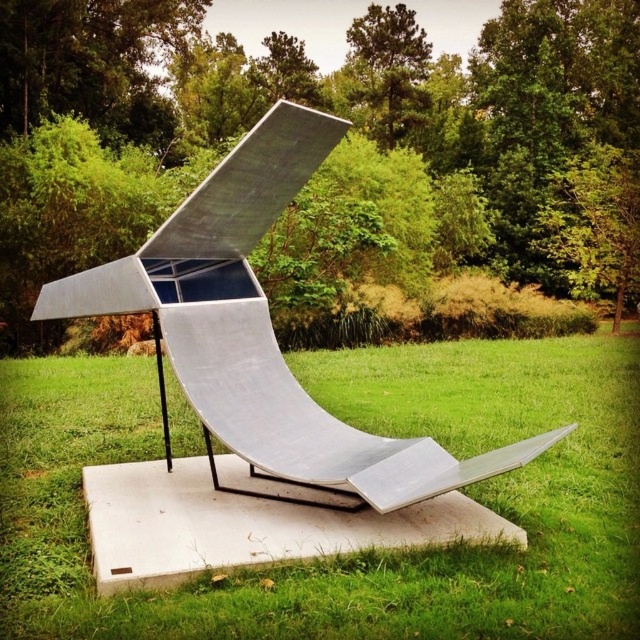
You are standing at the origin point of the coordinate system with the center of the image as the reference. You want to place a new decorative stone at the location of the green grass at center. What are the coordinates where you should place the stone?

The coordinates for placing the decorative stone should be at point (364,554), as that is where the green grass at center is located.

You are a gardener looking at the green grass at center and the silver polished metal sculpture at center. Which object is positioned lower in the scene?

The green grass at center is located below the silver polished metal sculpture at center, so it is positioned lower in the scene.